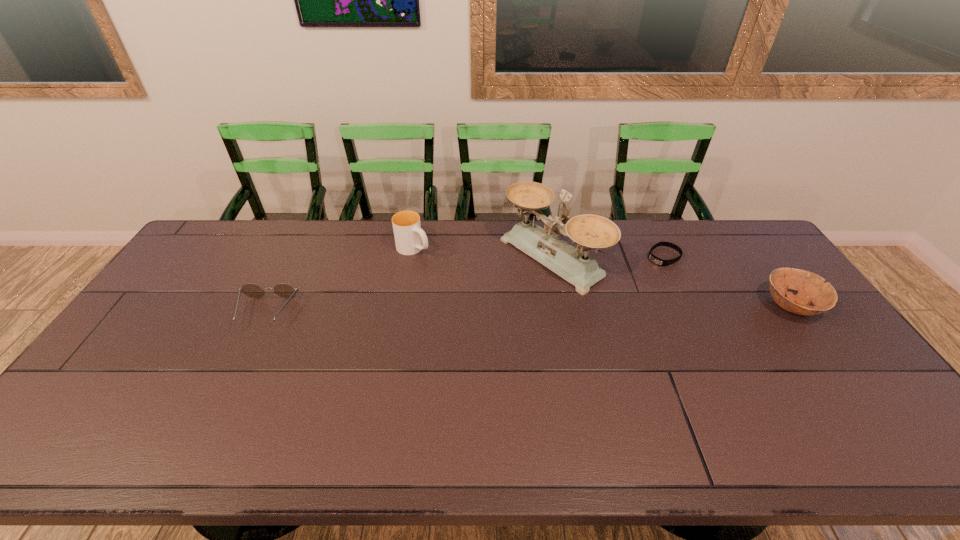
The image size is (960, 540). In order to click on vacant space on the desktop that is between the leftmost object and the rightmost object and is positioned on the display of the fourth object from left to right in this screenshot , I will do `click(585, 308)`.

This screenshot has width=960, height=540. What are the coordinates of `free spot on the desktop that is between the second shortest object and the third tallest object and is positioned with the handle on the side of the fourth shortest object` in the screenshot? It's located at (505, 309).

The width and height of the screenshot is (960, 540). Identify the location of vacant spot on the desktop that is between the leftmost object and the bowl and is positioned on the front-facing side of the tallest object. coord(469,309).